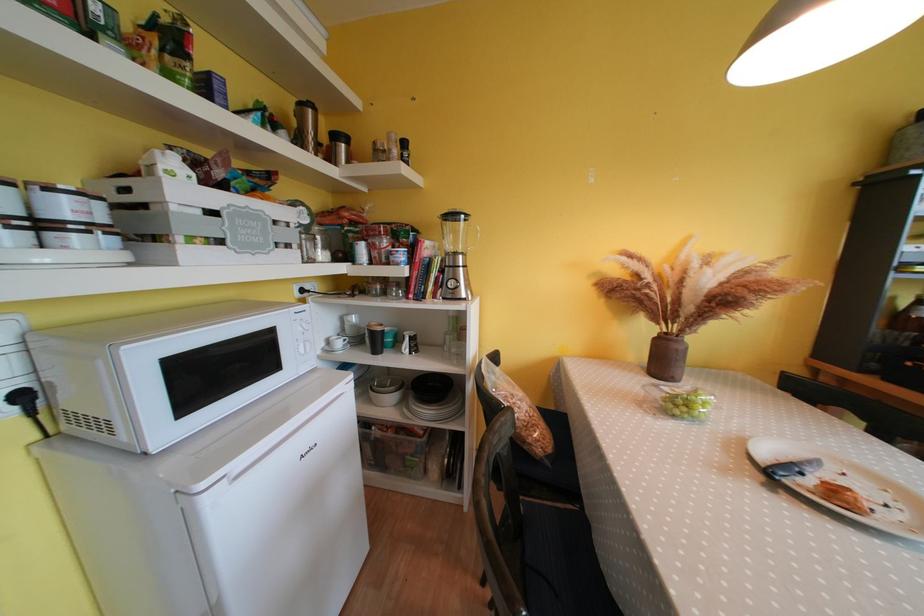
In order to click on black handled knife in this screenshot , I will do `click(792, 468)`.